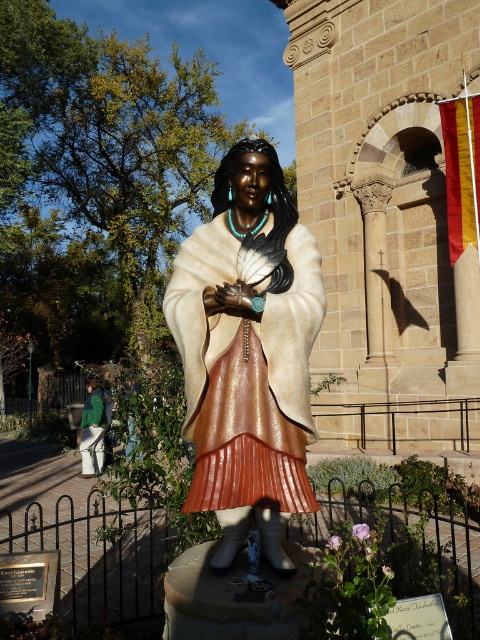
Question: Which point appears farthest from the camera in this image?

Choices:
 (A) (228, 404)
 (B) (94, 465)

Answer: (B)

Question: Is matte bronze statue at center to the right of green fabric pants at lower left from the viewer's perspective?

Choices:
 (A) yes
 (B) no

Answer: (A)

Question: Is matte bronze statue at center smaller than green fabric pants at lower left?

Choices:
 (A) no
 (B) yes

Answer: (A)

Question: Is matte bronze statue at center smaller than green fabric pants at lower left?

Choices:
 (A) no
 (B) yes

Answer: (A)

Question: Which point is farther from the camera taking this photo?

Choices:
 (A) (94, 378)
 (B) (284, 282)

Answer: (A)